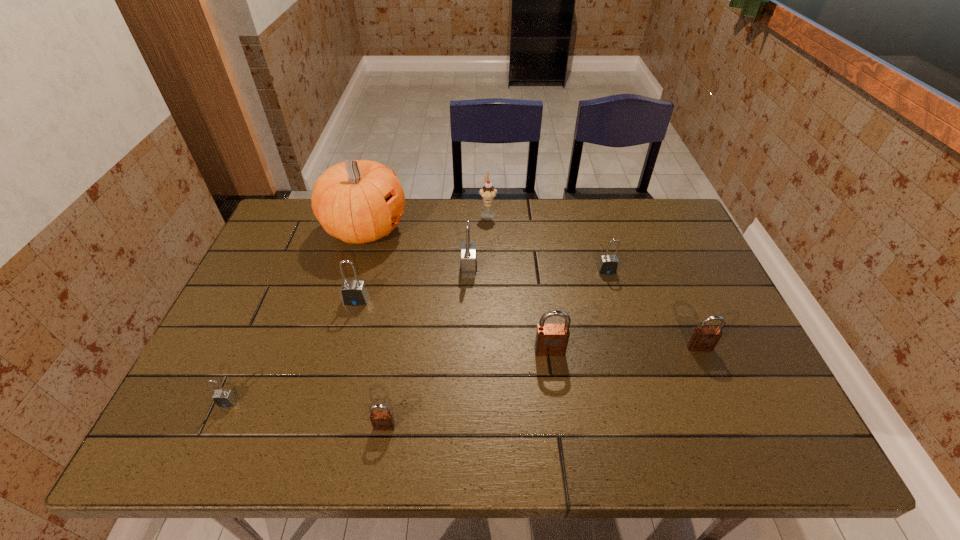
At what (x,y) coordinates should I click in order to perform the action: click on object present at the right edge. Please return your answer as a coordinate pair (x, y). Looking at the image, I should click on (703, 338).

Where is `object at the far left corner`? The height and width of the screenshot is (540, 960). object at the far left corner is located at coordinates (357, 201).

At what (x,y) coordinates should I click in order to perform the action: click on vacant space at the far edge. Please return your answer as a coordinate pair (x, y). Image resolution: width=960 pixels, height=540 pixels. Looking at the image, I should click on [x=575, y=200].

Find the location of `blank space at the near edge of the desktop`. blank space at the near edge of the desktop is located at coordinates (453, 444).

Locate an element on the screen. The image size is (960, 540). vacant area at the left edge is located at coordinates (252, 373).

The image size is (960, 540). Find the location of `vacant space at the right edge of the desktop`. vacant space at the right edge of the desktop is located at coordinates (703, 293).

The width and height of the screenshot is (960, 540). In the image, there is a desktop. Identify the location of vacant region at the far right corner. point(642,216).

Locate an element on the screen. empty location between the leftmost gray padlock and the second smallest gray padlock is located at coordinates (417, 336).

The height and width of the screenshot is (540, 960). In order to click on vacant area that lies between the smallest gray padlock and the smallest brown padlock in this screenshot , I will do `click(306, 414)`.

This screenshot has height=540, width=960. I want to click on empty space between the icecream and the orange pumpkin, so click(x=426, y=221).